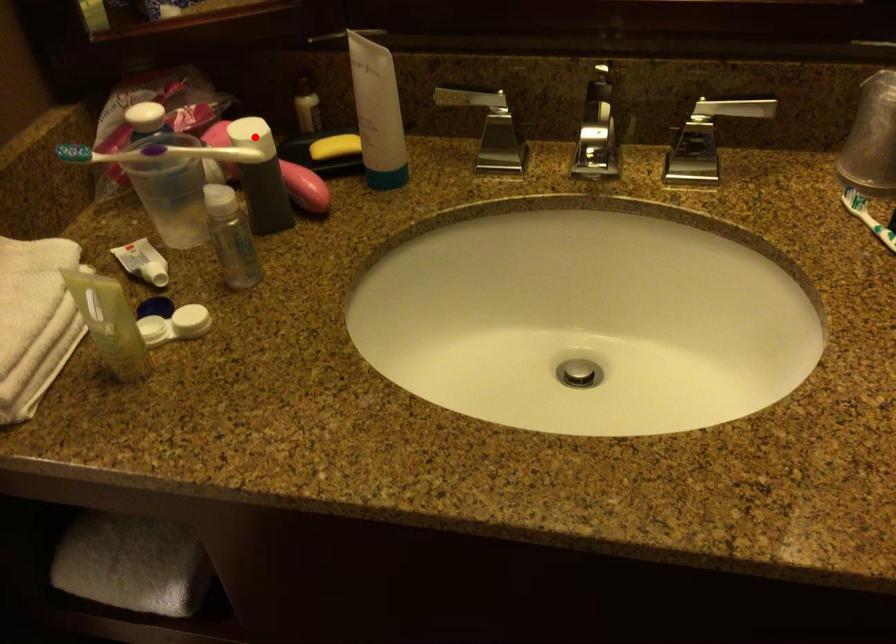
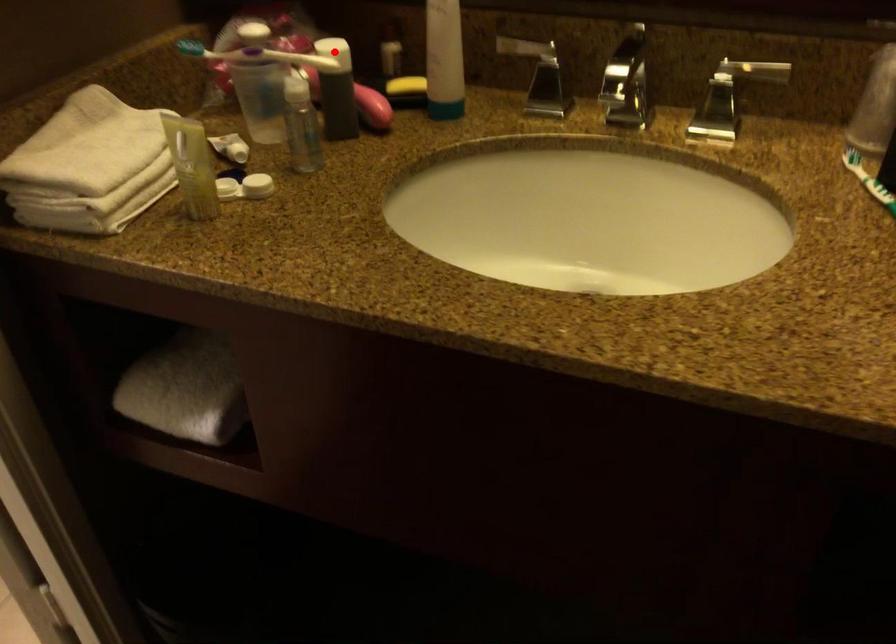
I am providing you with two images of the same scene from different viewpoints. A red point is marked on the first image and another point is marked on the second image. Is the marked point in image1 the same physical position as the marked point in image2?

Yes